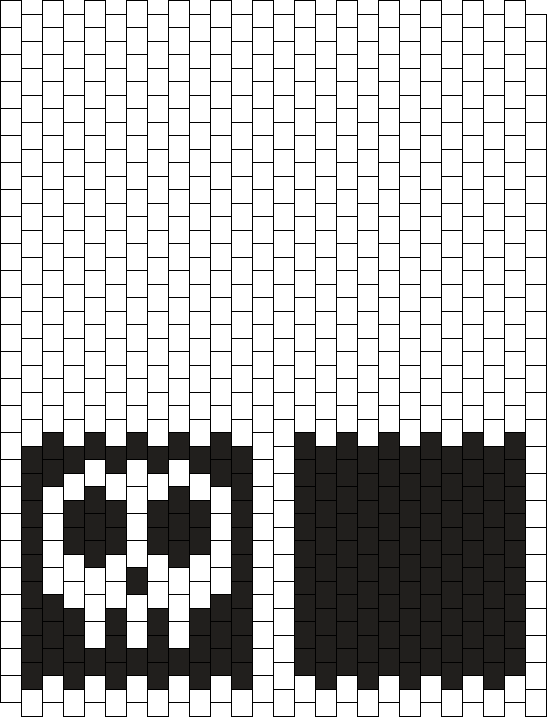
At what (x,y) coordinates should I click in order to perform the action: click on lower right white tile corner. Please return your answer as a coordinate pair (x, y). Looking at the image, I should click on (534, 706).